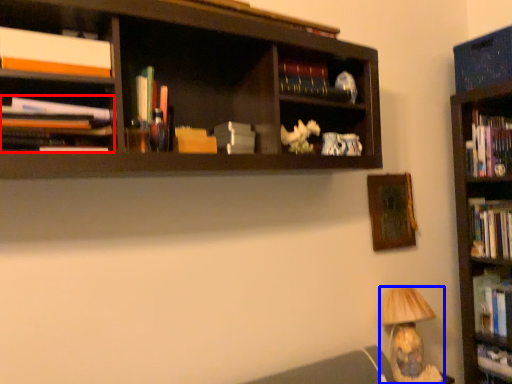
Question: Which of the following is the closest to the observer, book (highlighted by a red box) or lamp (highlighted by a blue box)?

Choices:
 (A) book
 (B) lamp

Answer: (A)